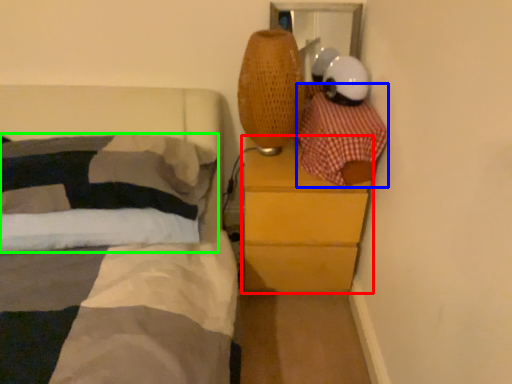
Question: Considering the real-world distances, which object is farthest from chest of drawers (highlighted by a red box)? blanket (highlighted by a blue box) or pillow (highlighted by a green box)?

Choices:
 (A) blanket
 (B) pillow

Answer: (B)